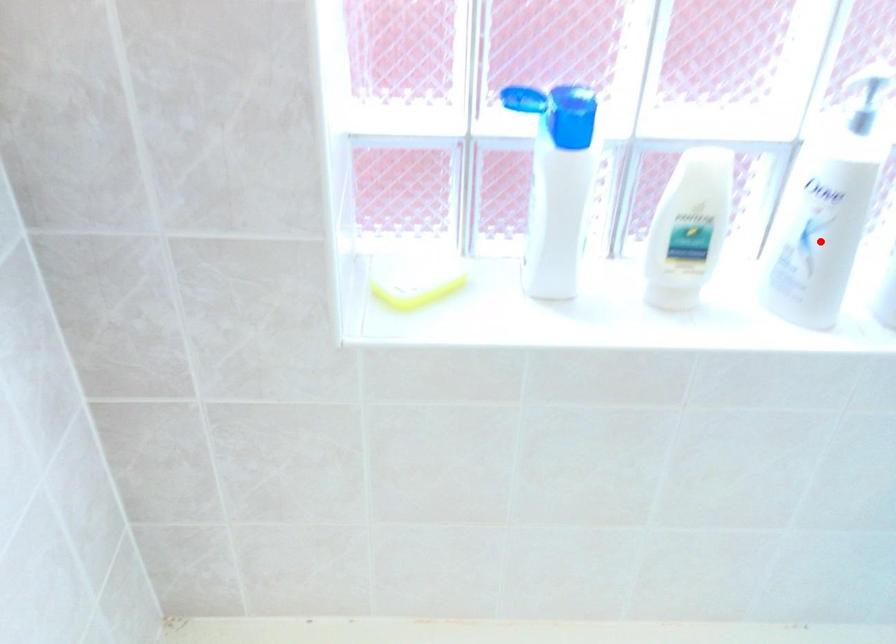
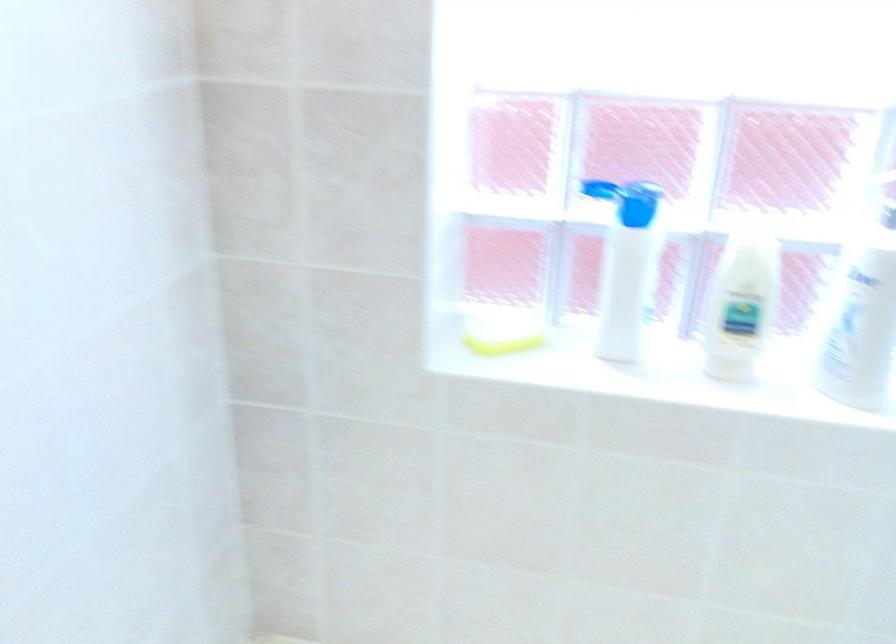
In the second image, find the point that corresponds to the highlighted location in the first image.

(860, 323)